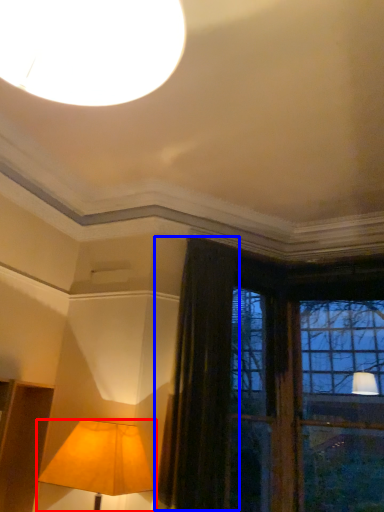
Question: Which object is further to the camera taking this photo, lamp (highlighted by a red box) or curtain (highlighted by a blue box)?

Choices:
 (A) lamp
 (B) curtain

Answer: (B)